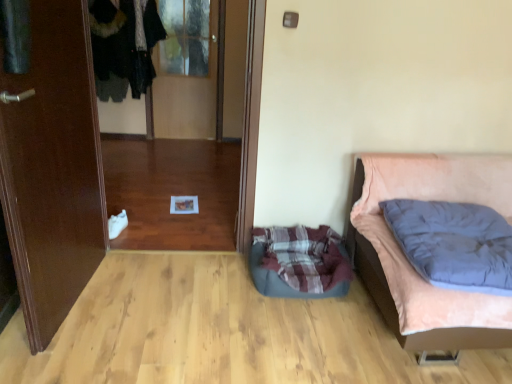
Question: Is plaid fabric dog bed at lower center thinner than velvet-like black coat at upper left?

Choices:
 (A) yes
 (B) no

Answer: (B)

Question: Does plaid fabric dog bed at lower center have a greater width compared to velvet-like black coat at upper left?

Choices:
 (A) yes
 (B) no

Answer: (A)

Question: From a real-world perspective, is plaid fabric dog bed at lower center on velvet-like black coat at upper left?

Choices:
 (A) yes
 (B) no

Answer: (B)

Question: Does plaid fabric dog bed at lower center have a lesser height compared to velvet-like black coat at upper left?

Choices:
 (A) no
 (B) yes

Answer: (B)

Question: Considering the relative positions of plaid fabric dog bed at lower center and velvet-like black coat at upper left in the image provided, is plaid fabric dog bed at lower center to the right of velvet-like black coat at upper left from the viewer's perspective?

Choices:
 (A) no
 (B) yes

Answer: (B)

Question: Is transparent glass door at center, which appears as the first glass door when viewed from the front, situated inside velvet pink bed at right or outside?

Choices:
 (A) outside
 (B) inside

Answer: (A)

Question: From the image's perspective, is transparent glass door at center, which appears as the first glass door when viewed from the front, located above or below velvet pink bed at right?

Choices:
 (A) below
 (B) above

Answer: (B)

Question: Considering the positions of transparent glass door at center, marked as the second glass door in a back-to-front arrangement, and velvet pink bed at right in the image, is transparent glass door at center, marked as the second glass door in a back-to-front arrangement, taller or shorter than velvet pink bed at right?

Choices:
 (A) tall
 (B) short

Answer: (A)

Question: Does point (224, 193) appear closer or farther from the camera than point (420, 339)?

Choices:
 (A) closer
 (B) farther

Answer: (B)

Question: From the image's perspective, is plaid fabric dog bed at lower center positioned above or below dark blue quilted pillow at right?

Choices:
 (A) above
 (B) below

Answer: (B)

Question: Considering the positions of plaid fabric dog bed at lower center and dark blue quilted pillow at right in the image, is plaid fabric dog bed at lower center wider or thinner than dark blue quilted pillow at right?

Choices:
 (A) thin
 (B) wide

Answer: (A)

Question: Would you say plaid fabric dog bed at lower center is inside or outside dark blue quilted pillow at right?

Choices:
 (A) inside
 (B) outside

Answer: (B)

Question: Is plaid fabric dog bed at lower center to the left or to the right of dark blue quilted pillow at right in the image?

Choices:
 (A) left
 (B) right

Answer: (A)

Question: From the image's perspective, is brown wooden door at left positioned above or below velvet-like black coat at upper left?

Choices:
 (A) below
 (B) above

Answer: (A)

Question: From their relative heights in the image, would you say brown wooden door at left is taller or shorter than velvet-like black coat at upper left?

Choices:
 (A) short
 (B) tall

Answer: (B)